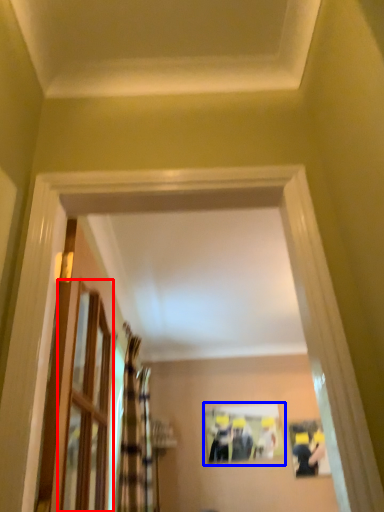
Question: Which of the following is the farthest to the observer, glass door (highlighted by a red box) or picture frame (highlighted by a blue box)?

Choices:
 (A) glass door
 (B) picture frame

Answer: (B)